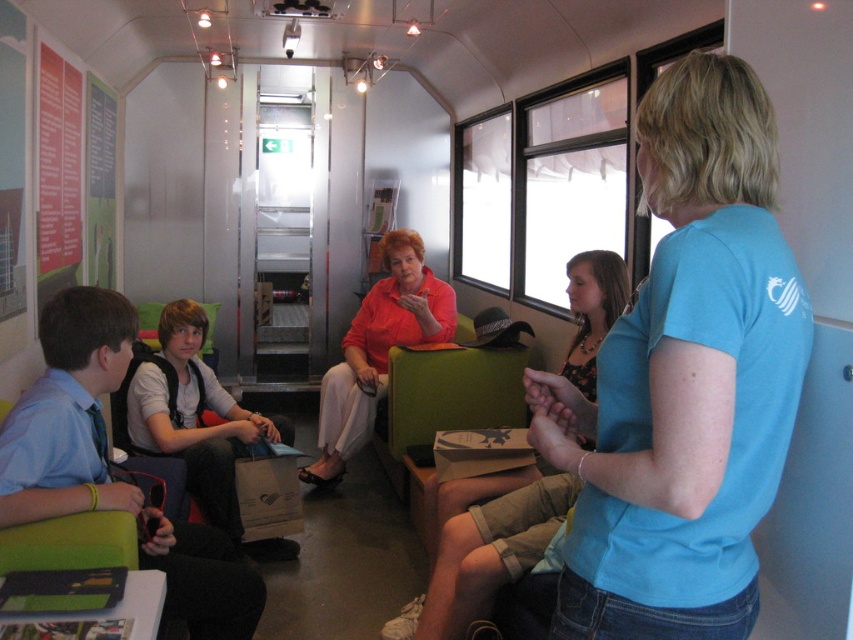
Where is the blue cotton shirt at upper right located in the image?

The blue cotton shirt at upper right is located at point (685, 380).

You are a photographer standing at the back of the train carriage. You want to take a photo that includes both the blue cotton shirt at upper right and the matte orange shirt at center. Given that your camera has a maximum focus range of 10 feet, will you be able to capture both subjects in focus without moving closer?

The blue cotton shirt at upper right and the matte orange shirt at center are 9.56 feet apart. Since the distance between them is within the camera maximum focus range of 10 feet, you can capture both subjects in focus without moving closer.

Consider the image. You are standing in the train carriage and want to place your 1.5 meter long surfboard vertically against the matte black backpack at left. Is there enough space between you and the backpack to do this?

The distance between the matte black backpack at left and the viewer is 1.78 meters. Since the surfboard is 1.5 meters long, there is sufficient space to place it vertically against the backpack.